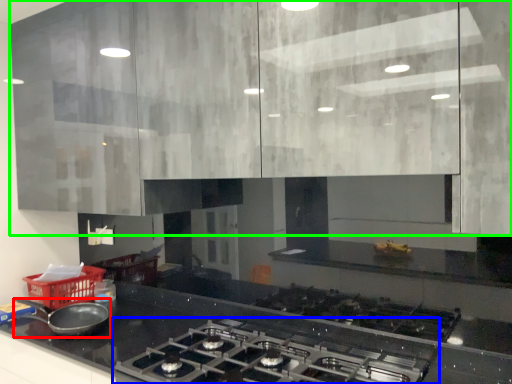
Question: Based on their relative distances, which object is farther from kitchen appliance (highlighted by a red box)? Choose from gas stove (highlighted by a blue box) and cabinetry (highlighted by a green box).

Choices:
 (A) gas stove
 (B) cabinetry

Answer: (B)